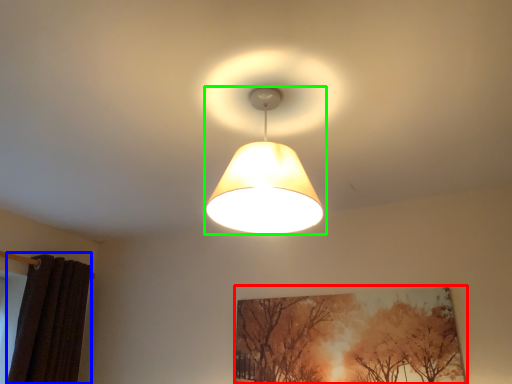
Question: Which is nearer to the picture frame (highlighted by a red box)? curtain (highlighted by a blue box) or lamp (highlighted by a green box).

Choices:
 (A) curtain
 (B) lamp

Answer: (B)